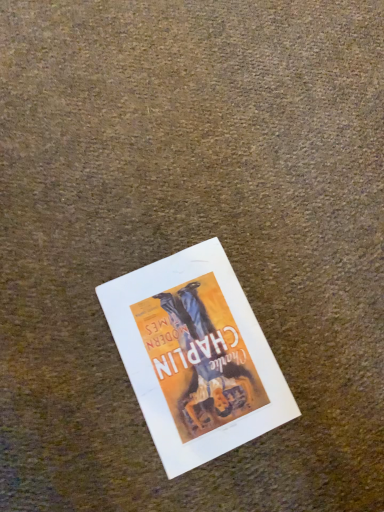
This screenshot has height=512, width=384. Identify the location of empty space that is ontop of matte paper poster at center (from a real-world perspective). (195, 349).